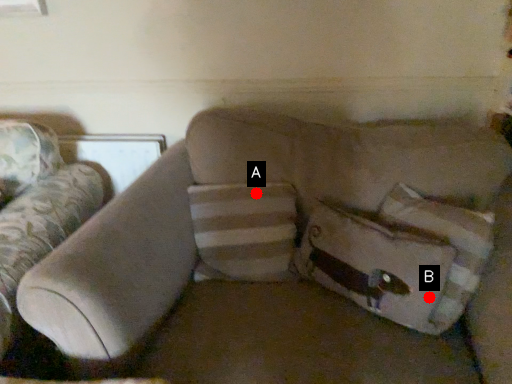
Question: Two points are circled on the image, labeled by A and B beside each circle. Which point appears farthest from the camera in this image?

Choices:
 (A) A is further
 (B) B is further

Answer: (A)